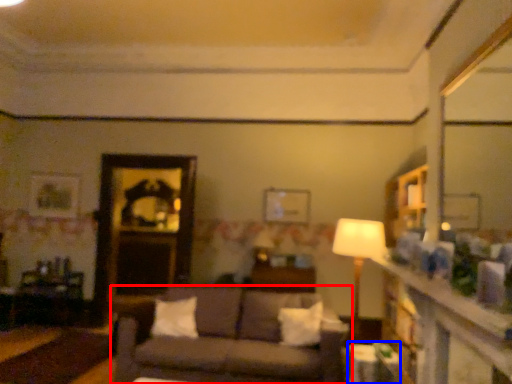
Question: Which of the following is the farthest to the observer, studio couch (highlighted by a red box) or table (highlighted by a blue box)?

Choices:
 (A) studio couch
 (B) table

Answer: (A)